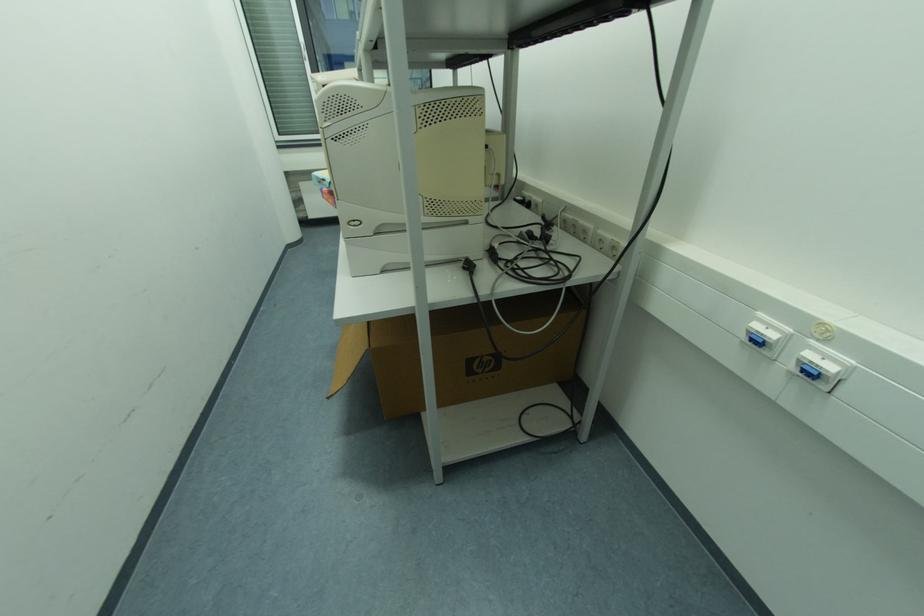
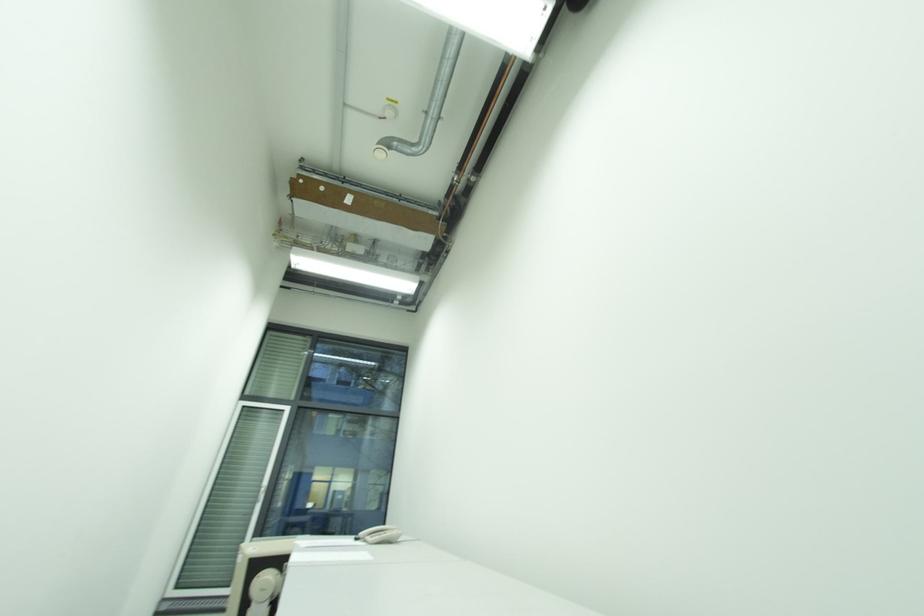
Question: The images are taken continuously from a first-person perspective. In which direction is your viewpoint rotating?

Choices:
 (A) Left
 (B) Right
 (C) Up
 (D) Down

Answer: (C)